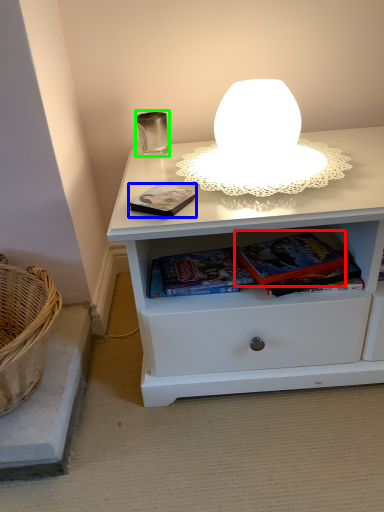
Question: Considering the real-world distances, which object is closest to paperback book (highlighted by a red box)? paperback book (highlighted by a blue box) or candle holder (highlighted by a green box).

Choices:
 (A) paperback book
 (B) candle holder

Answer: (A)